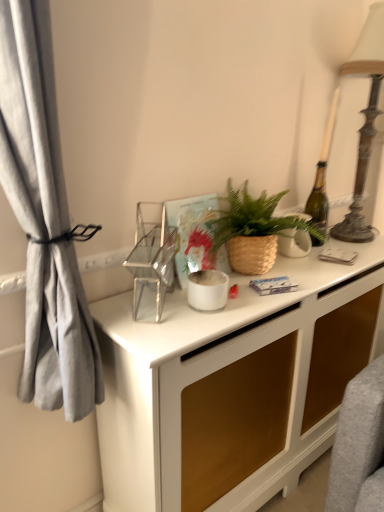
Locate an element on the screen. Image resolution: width=384 pixels, height=512 pixels. vacant area situated below brown woven basket at center (from a real-world perspective) is located at coordinates (284, 270).